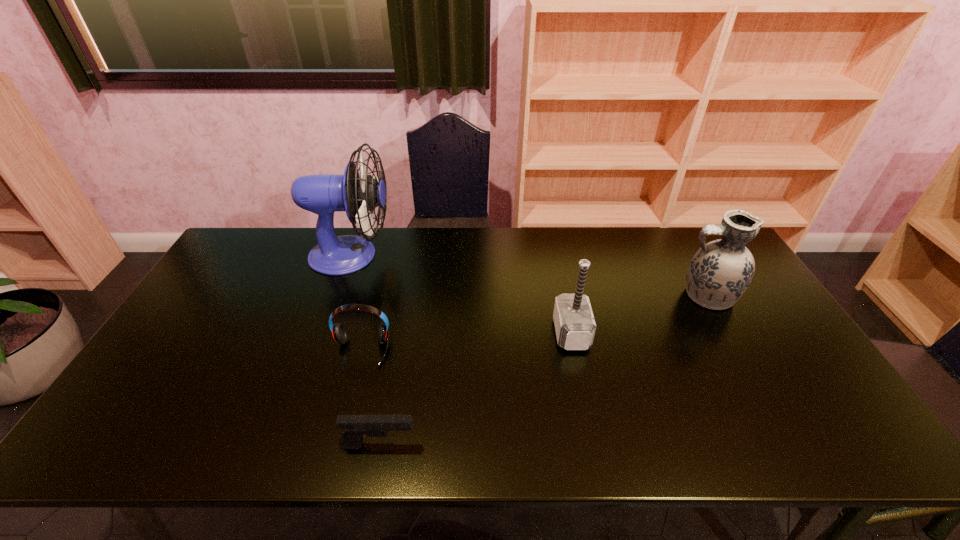
Find the location of a particular element. vacant space situated 0.350m for striking with the head of the hammer is located at coordinates (430, 333).

Find the location of a particular element. free space located 0.170m for striking with the head of the hammer is located at coordinates (494, 333).

Identify the location of free space located for striking with the head of the hammer. (444, 333).

The height and width of the screenshot is (540, 960). Find the location of `free region located with the microphone attached to the side of the second shortest object`. free region located with the microphone attached to the side of the second shortest object is located at coordinates 349,398.

The image size is (960, 540). I want to click on free space located 0.110m on the front-facing side of the shortest object, so (467, 446).

Locate an element on the screen. The height and width of the screenshot is (540, 960). object at the far edge is located at coordinates click(x=359, y=196).

Identify the location of object located in the near edge section of the desktop. This screenshot has height=540, width=960. [356, 427].

Identify the location of object positioned at the right edge. (719, 273).

In the image, there is a desktop. Identify the location of blank space at the far edge. (492, 249).

Identify the location of free space at the near edge. (575, 454).